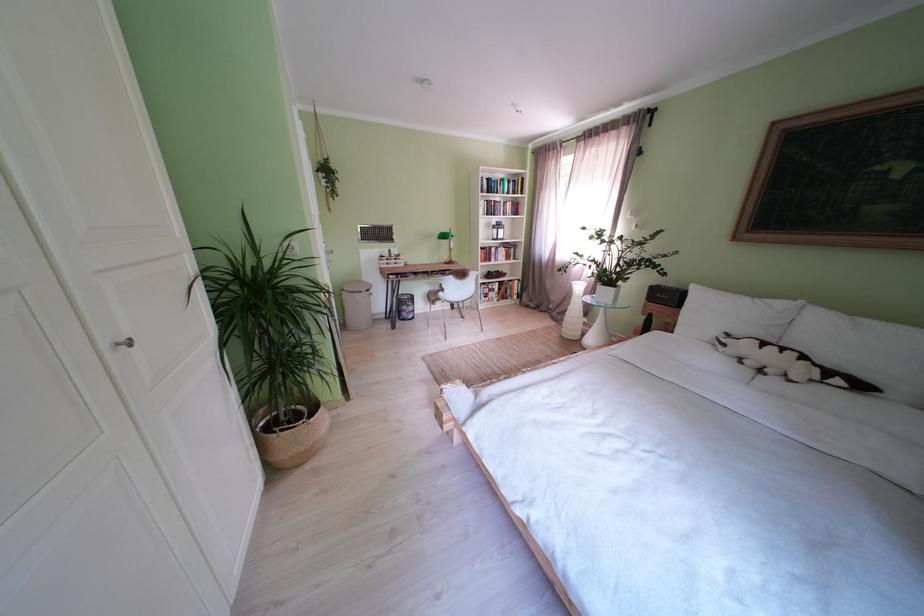
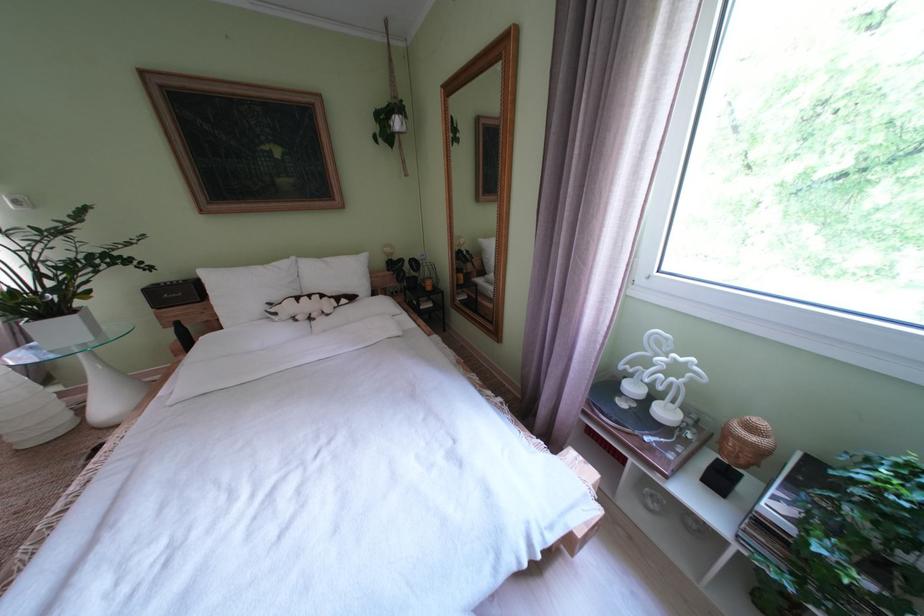
First-person continuous shooting, in which direction is the camera rotating?

The camera rotated toward right-down.